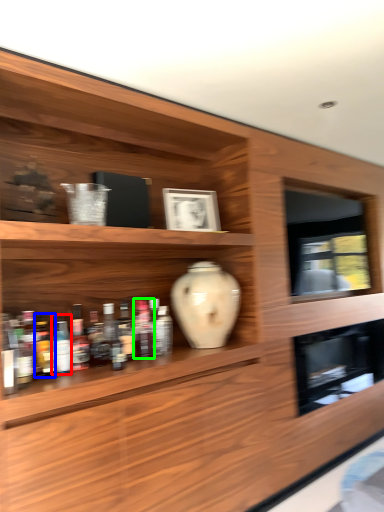
Question: Which is farther away from bottle (highlighted by a red box)? bottle (highlighted by a blue box) or bottle (highlighted by a green box)?

Choices:
 (A) bottle
 (B) bottle

Answer: (B)